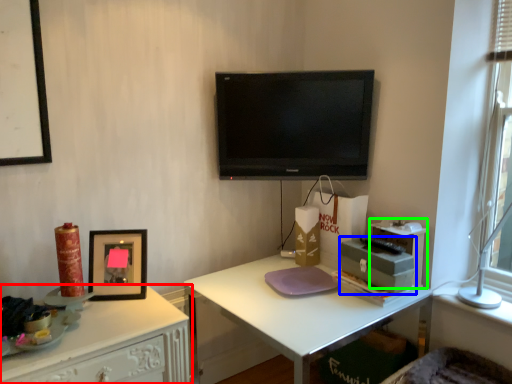
Question: Which object is positioned farthest from desk (highlighted by a red box)? Select from box (highlighted by a blue box) and box (highlighted by a green box).

Choices:
 (A) box
 (B) box

Answer: (B)